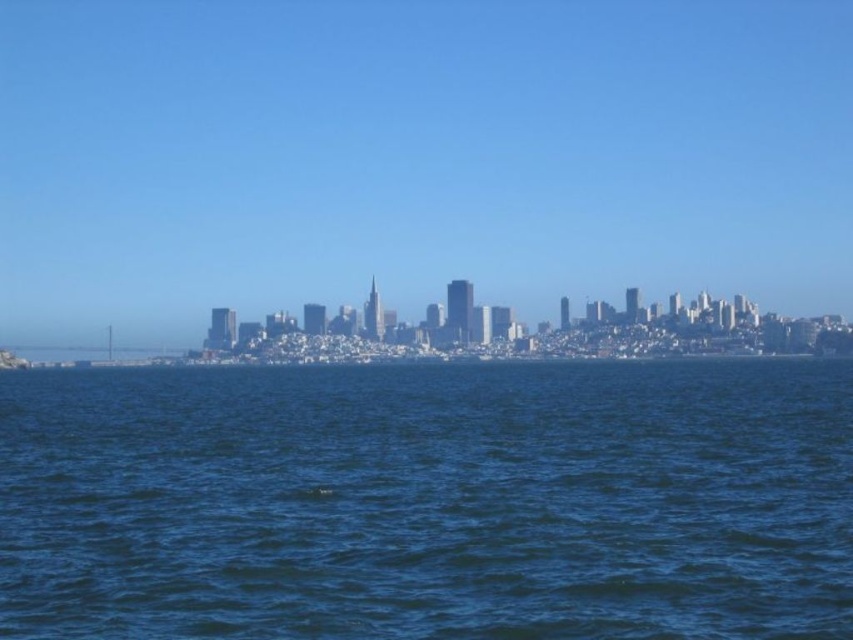
Does transparent glass skyline at center have a greater height compared to dark blue water at center?

Yes.

Is transparent glass skyline at center positioned behind dark blue water at center?

That is True.

I want to click on transparent glass skyline at center, so pyautogui.click(x=415, y=157).